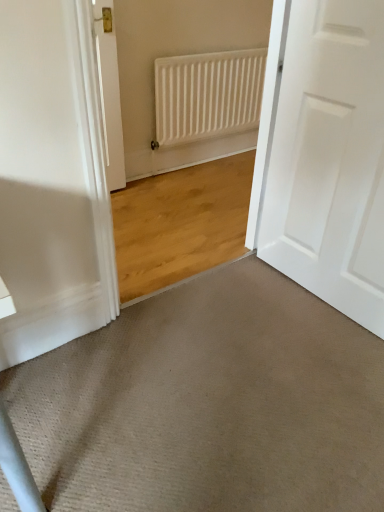
Where is `white matte door at right`? white matte door at right is located at coordinates (330, 158).

Image resolution: width=384 pixels, height=512 pixels. In order to click on beige carpet at lower center in this screenshot , I will do `click(208, 404)`.

In order to face white matte radiator at upper center, should I rotate leftwards or rightwards?

You should look right and rotate roughly 3.197 degrees.

What do you see at coordinates (207, 95) in the screenshot?
I see `white matte radiator at upper center` at bounding box center [207, 95].

At what (x,y) coordinates should I click in order to perform the action: click on white matte door at right. Please return your answer as a coordinate pair (x, y). Looking at the image, I should click on (330, 158).

In the image, there is a white matte door at right. At what (x,y) coordinates should I click in order to perform the action: click on doormat below it (from a real-world perspective). Please return your answer as a coordinate pair (x, y). The height and width of the screenshot is (512, 384). Looking at the image, I should click on (208, 404).

From the image's perspective, is beige carpet at lower center located above or below white matte door at right?

Clearly, from the image's perspective, beige carpet at lower center is below white matte door at right.

Which object is closer to the camera, beige carpet at lower center or white matte door at right?

beige carpet at lower center is more forward.

Between white matte door at right and white matte radiator at upper center, which one appears on the left side from the viewer's perspective?

white matte radiator at upper center is more to the left.

Can you confirm if white matte door at right is bigger than white matte radiator at upper center?

Correct, white matte door at right is larger in size than white matte radiator at upper center.

Is white matte door at right outside of white matte radiator at upper center?

white matte door at right lies outside white matte radiator at upper center's area.

Does white matte radiator at upper center turn towards beige carpet at lower center?

Yes.

From a real-world perspective, relative to beige carpet at lower center, is white matte radiator at upper center vertically above or below?

In terms of real-world spatial position, white matte radiator at upper center is above beige carpet at lower center.

In the scene shown: Can you confirm if white matte radiator at upper center is positioned to the right of beige carpet at lower center?

Yes.

Looking at this image, is white matte radiator at upper center shorter than beige carpet at lower center?

In fact, white matte radiator at upper center may be taller than beige carpet at lower center.

Between beige carpet at lower center and white matte radiator at upper center, which one appears on the right side from the viewer's perspective?

From the viewer's perspective, white matte radiator at upper center appears more on the right side.

Where is `doormat in front of the white matte radiator at upper center`? The image size is (384, 512). doormat in front of the white matte radiator at upper center is located at coordinates (208, 404).

Which is closer to the camera, (163, 444) or (180, 114)?

Clearly, point (163, 444) is closer to the camera than point (180, 114).

Which of these two, white matte door at right or beige carpet at lower center, is wider?

With larger width is beige carpet at lower center.

Is white matte door at right facing away from beige carpet at lower center?

No, white matte door at right is not facing the opposite direction of beige carpet at lower center.

Which is in front, white matte door at right or beige carpet at lower center?

beige carpet at lower center is in front.

From the image's perspective, is white matte door at right located above beige carpet at lower center?

Yes.

Considering the relative positions of white matte radiator at upper center and white matte door at right in the image provided, is white matte radiator at upper center behind white matte door at right?

Yes, it is.

What are the coordinates of `door below the white matte radiator at upper center (from the image's perspective)` in the screenshot? It's located at (330, 158).

Would you say white matte radiator at upper center is inside or outside white matte door at right?

white matte radiator at upper center cannot be found inside white matte door at right.

Which of these two, white matte radiator at upper center or white matte door at right, stands taller?

white matte door at right.

Where is `door on the right of the beige carpet at lower center`? door on the right of the beige carpet at lower center is located at coordinates (330, 158).

Locate an element on the screen. This screenshot has width=384, height=512. radiator behind the white matte door at right is located at coordinates (207, 95).

Which object lies further to the anchor point beige carpet at lower center, white matte door at right or white matte radiator at upper center?

Among the two, white matte radiator at upper center is located further to beige carpet at lower center.

From the image, which object appears to be nearer to beige carpet at lower center, white matte radiator at upper center or white matte door at right?

white matte door at right lies closer to beige carpet at lower center than the other object.

From the image, which object appears to be nearer to white matte radiator at upper center, white matte door at right or beige carpet at lower center?

The object closer to white matte radiator at upper center is white matte door at right.

From the picture: From the image, which object appears to be farther from white matte radiator at upper center, beige carpet at lower center or white matte door at right?

beige carpet at lower center.

Looking at the image, which one is located closer to white matte door at right, beige carpet at lower center or white matte radiator at upper center?

Among the two, beige carpet at lower center is located nearer to white matte door at right.

Considering their positions, is white matte radiator at upper center positioned further to white matte door at right than beige carpet at lower center?

Among the two, white matte radiator at upper center is located further to white matte door at right.

Locate an element on the screen. Image resolution: width=384 pixels, height=512 pixels. door between beige carpet at lower center and white matte radiator at upper center along the z-axis is located at coordinates (330, 158).